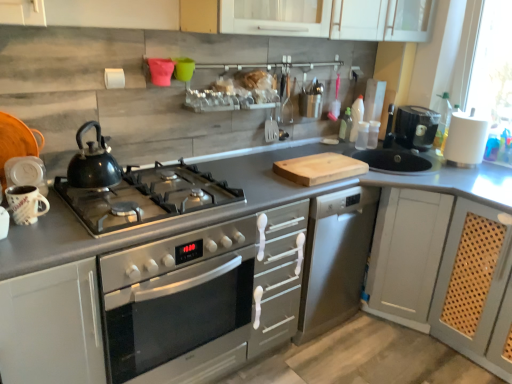
Question: Considering the positions of shiny black kettle at left and matte gray cabinet at right, the 1th cabinetry in the right-to-left sequence, in the image, is shiny black kettle at left bigger or smaller than matte gray cabinet at right, the 1th cabinetry in the right-to-left sequence,?

Choices:
 (A) small
 (B) big

Answer: (A)

Question: In terms of height, does shiny black kettle at left look taller or shorter compared to matte gray cabinet at right, arranged as the 2th cabinetry when viewed from the left?

Choices:
 (A) short
 (B) tall

Answer: (A)

Question: Which object is positioned closest to the wooden cutting board at center?

Choices:
 (A) matte gray cabinet at right, the 1th cabinetry in the right-to-left sequence
 (B) matte ceramic mug at left, which is the 1th appliance in bottom-to-top order
 (C) black plastic coffee machine at right
 (D) stainless steel oven at center
 (E) white matte paper towel holder at upper right, the 1th appliance in the right-to-left sequence

Answer: (A)

Question: Based on their relative distances, which object is farther from the matte gray cabinet at right, arranged as the 2th cabinetry when viewed from the left?

Choices:
 (A) matte ceramic mug at left, which is counted as the first appliance, starting from the front
 (B) stainless steel oven at center
 (C) transparent plastic bottle at upper right
 (D) wooden cutting board at center
 (E) white matte cabinet at lower left, which is the 1th cabinetry from left to right

Answer: (A)